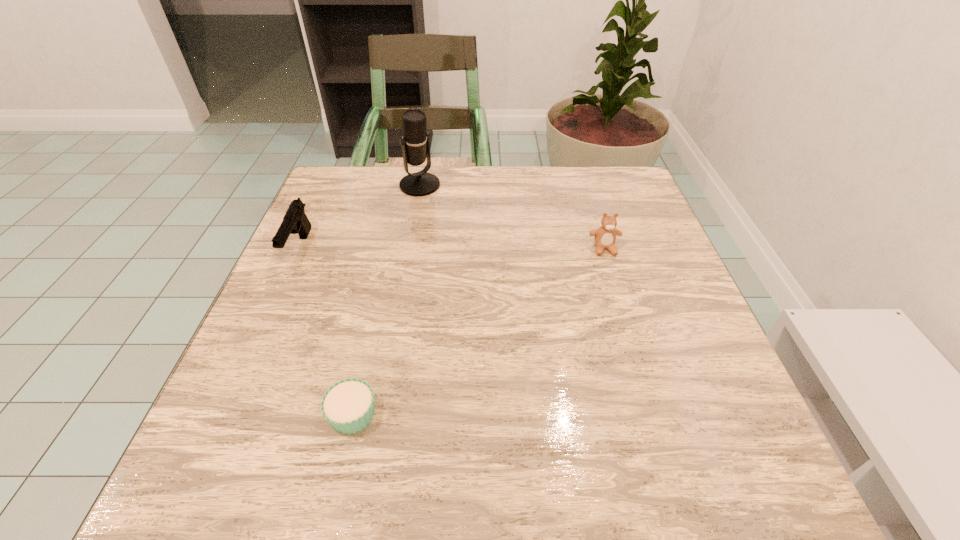
The height and width of the screenshot is (540, 960). I want to click on object that is at the far edge, so click(x=415, y=145).

Locate an element on the screen. The width and height of the screenshot is (960, 540). object positioned at the left edge is located at coordinates (295, 221).

Locate an element on the screen. The height and width of the screenshot is (540, 960). object present at the right edge is located at coordinates (605, 236).

In the image, there is a desktop. Where is `blank space at the far edge`? blank space at the far edge is located at coordinates (432, 216).

The height and width of the screenshot is (540, 960). Find the location of `free space at the near edge of the desktop`. free space at the near edge of the desktop is located at coordinates (372, 489).

You are a GUI agent. You are given a task and a screenshot of the screen. Output one action in this format:
    pyautogui.click(x=<x>, y=<y>)
    Task: Click on the free space at the right edge of the desktop
    The height and width of the screenshot is (540, 960).
    Given the screenshot: What is the action you would take?
    pyautogui.click(x=695, y=382)

I want to click on vacant region at the far left corner of the desktop, so click(356, 194).

Where is `vacant space at the near left corner`? Image resolution: width=960 pixels, height=540 pixels. vacant space at the near left corner is located at coordinates (212, 468).

The image size is (960, 540). I want to click on vacant space at the far right corner, so click(x=631, y=194).

The width and height of the screenshot is (960, 540). In the image, there is a desktop. In order to click on free space at the near right corner in this screenshot , I will do `click(679, 488)`.